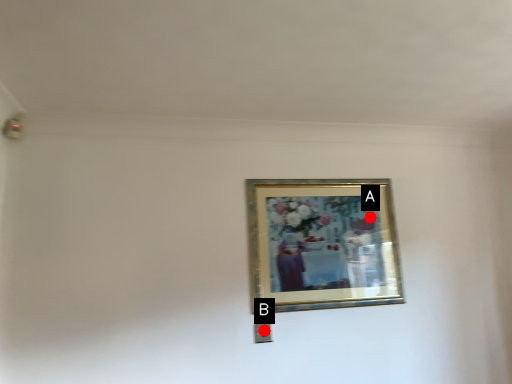
Question: Two points are circled on the image, labeled by A and B beside each circle. Among these points, which one is farthest from the camera?

Choices:
 (A) A is further
 (B) B is further

Answer: (A)